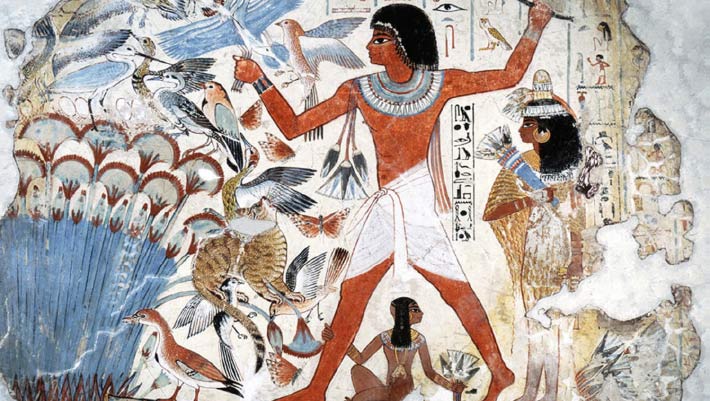
Locate an element on the screen. The image size is (710, 401). chest is located at coordinates (390, 157).